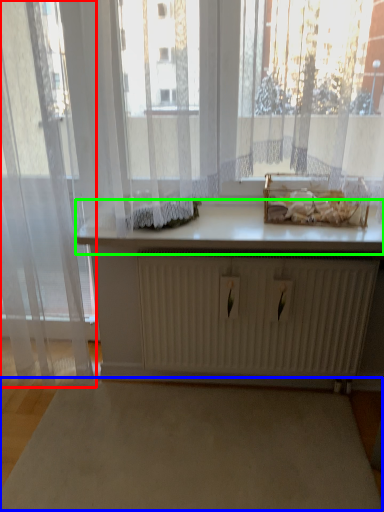
Question: Based on their relative distances, which object is nearer to curtain (highlighted by a red box)? Choose from plain (highlighted by a blue box) and counter top (highlighted by a green box).

Choices:
 (A) plain
 (B) counter top

Answer: (B)